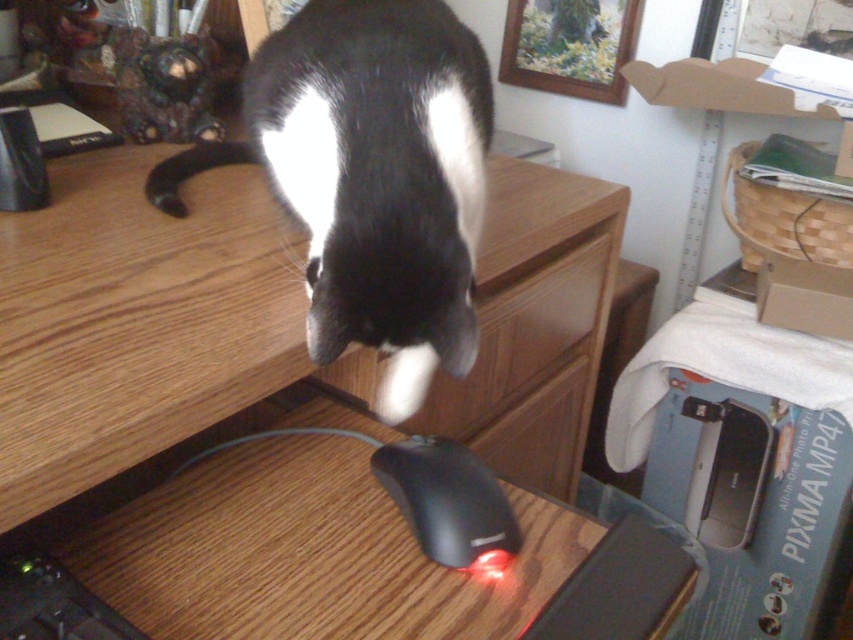
Between black fur cat at upper center and black matte mouse at center, which one appears on the right side from the viewer's perspective?

Answer: From the viewer's perspective, black matte mouse at center appears more on the right side.

Who is more forward, [175,164] or [438,508]?

Positioned in front is point [438,508].

The image size is (853, 640). Find the location of `black fur cat at upper center`. black fur cat at upper center is located at coordinates pos(370,177).

Between point (498, 316) and point (471, 458), which one is positioned behind?

The point (498, 316) is more distant.

Does wooden drawer at center have a larger size compared to black matte mouse at center?

Indeed, wooden drawer at center has a larger size compared to black matte mouse at center.

Is point (564, 346) closer to camera compared to point (422, 538)?

That is False.

In order to click on wooden drawer at center in this screenshot , I will do `click(497, 340)`.

Which is below, wooden at center or wooden drawer at center?

wooden at center is below.

From the picture: Can you confirm if wooden at center is bigger than wooden drawer at center?

Yes.

At what (x,y) coordinates should I click in order to perform the action: click on wooden at center. Please return your answer as a coordinate pair (x, y). Looking at the image, I should click on 142,328.